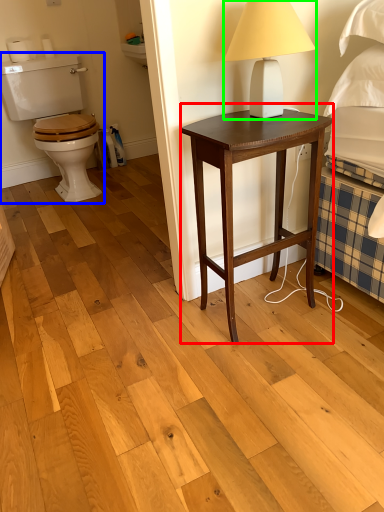
Question: Which is farther away from nightstand (highlighted by a red box)? sit (highlighted by a blue box) or table lamp (highlighted by a green box)?

Choices:
 (A) sit
 (B) table lamp

Answer: (A)